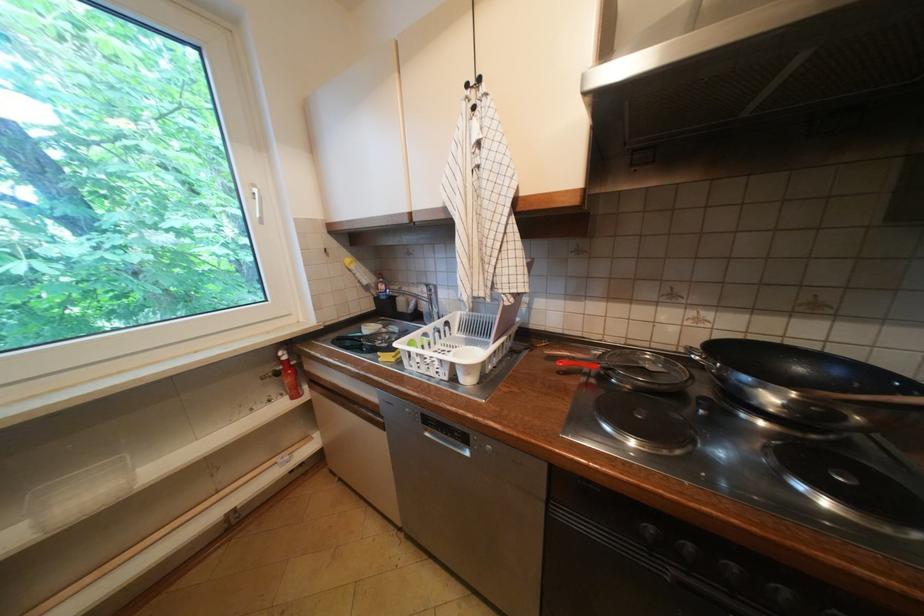
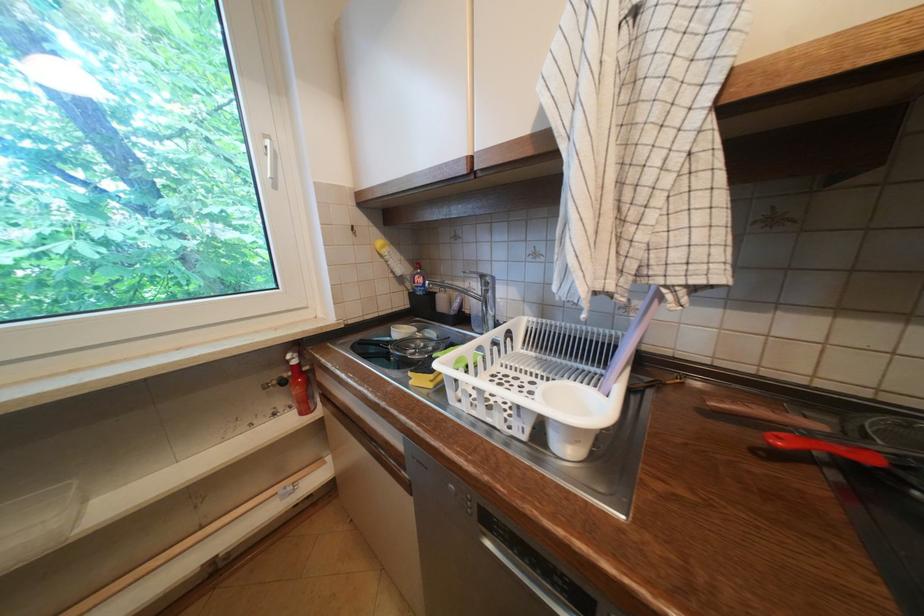
Question: What movement of the cameraman would produce the second image?

Choices:
 (A) Left
 (B) Right
 (C) Forward
 (D) Backward

Answer: (C)